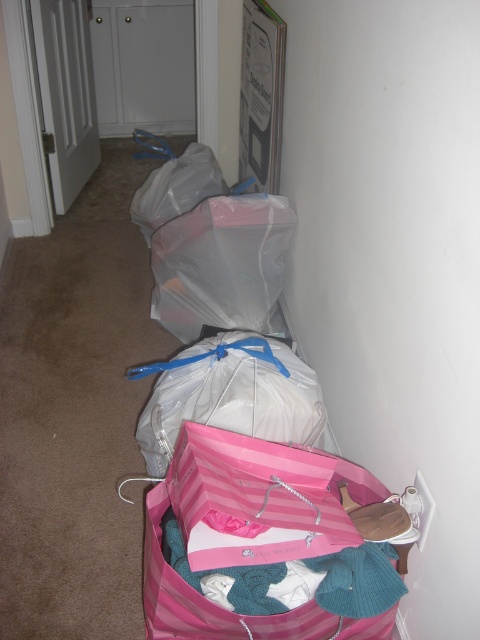
In the scene shown: Can you confirm if pink striped paper bag at lower center is positioned to the right of clear plastic bag at center?

Correct, you'll find pink striped paper bag at lower center to the right of clear plastic bag at center.

Can you confirm if pink striped paper bag at lower center is smaller than clear plastic bag at center?

Actually, pink striped paper bag at lower center might be larger than clear plastic bag at center.

This screenshot has width=480, height=640. What do you see at coordinates (250, 520) in the screenshot?
I see `pink striped paper bag at lower center` at bounding box center [250, 520].

At what (x,y) coordinates should I click in order to perform the action: click on pink striped paper bag at lower center. Please return your answer as a coordinate pair (x, y). This screenshot has height=640, width=480. Looking at the image, I should click on (250, 520).

Is pink striped paper bag at lower center closer to the viewer compared to transparent plastic bag at center?

Yes, pink striped paper bag at lower center is closer to the viewer.

Does pink striped paper bag at lower center appear over transparent plastic bag at center?

Incorrect, pink striped paper bag at lower center is not positioned above transparent plastic bag at center.

At what (x,y) coordinates should I click in order to perform the action: click on pink striped paper bag at lower center. Please return your answer as a coordinate pair (x, y). The width and height of the screenshot is (480, 640). Looking at the image, I should click on (250, 520).

Who is more forward, (285,364) or (171,310)?

Point (285,364)

Between clear plastic bag at center and transparent plastic bag at center, which one appears on the right side from the viewer's perspective?

clear plastic bag at center is more to the right.

This screenshot has width=480, height=640. What do you see at coordinates (229, 394) in the screenshot? I see `clear plastic bag at center` at bounding box center [229, 394].

You are a GUI agent. You are given a task and a screenshot of the screen. Output one action in this format:
    pyautogui.click(x=<x>, y=<y>)
    Task: Click on the clear plastic bag at center
    Image resolution: width=480 pixels, height=640 pixels.
    Given the screenshot: What is the action you would take?
    pyautogui.click(x=229, y=394)